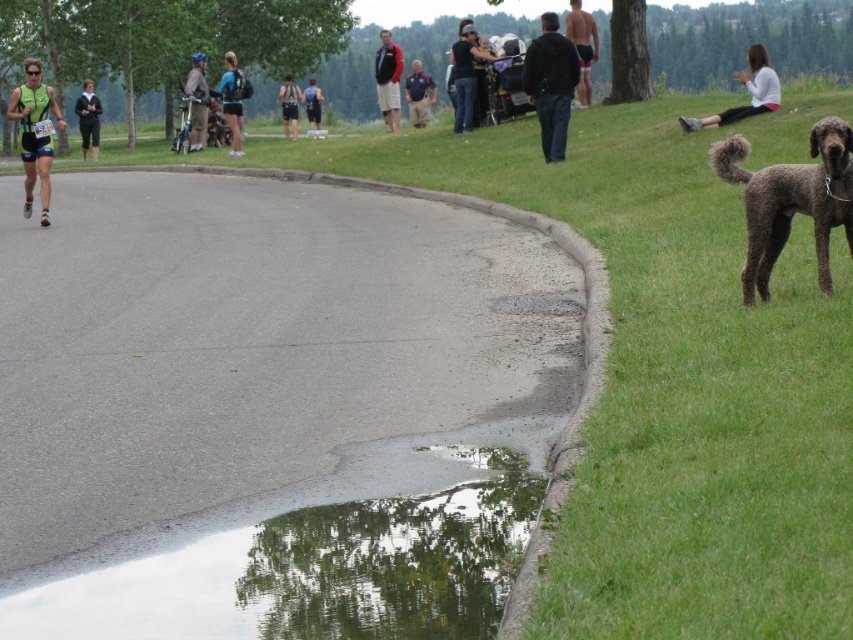
How much distance is there between matte black jacket at center and red jacket at center?

22.25 feet

Does matte black jacket at center come behind red jacket at center?

No, matte black jacket at center is in front of red jacket at center.

Is point (466, 22) closer to camera compared to point (383, 118)?

That is True.

The height and width of the screenshot is (640, 853). In order to click on matte black jacket at center in this screenshot , I will do `click(465, 76)`.

Who is lower down, blue cotton shirt at center or dark blue shorts at left?

blue cotton shirt at center is lower down.

Between point (416, 109) and point (84, 80), which one is positioned in front?

Point (416, 109) is in front.

Locate an element on the screen. This screenshot has width=853, height=640. blue cotton shirt at center is located at coordinates (419, 93).

Consider the image. Is matte blue helmet at upper left taller than dark blue shorts at left?

In fact, matte blue helmet at upper left may be shorter than dark blue shorts at left.

Which is behind, point (200, 131) or point (94, 132)?

The point (94, 132) is behind.

Which is behind, point (192, 84) or point (90, 115)?

The point (90, 115) is behind.

The image size is (853, 640). I want to click on matte blue helmet at upper left, so click(196, 100).